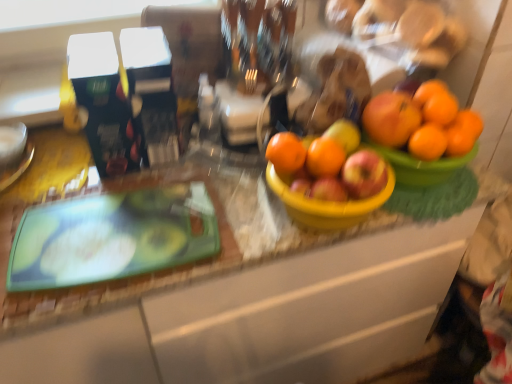
This screenshot has height=384, width=512. In order to click on free point behind green glossy cutting board at left in this screenshot , I will do `click(98, 175)`.